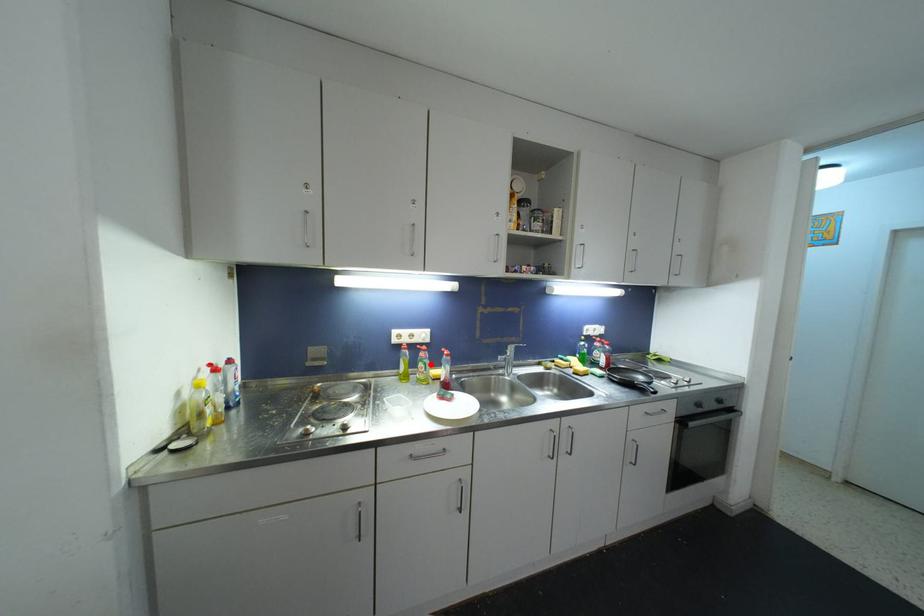
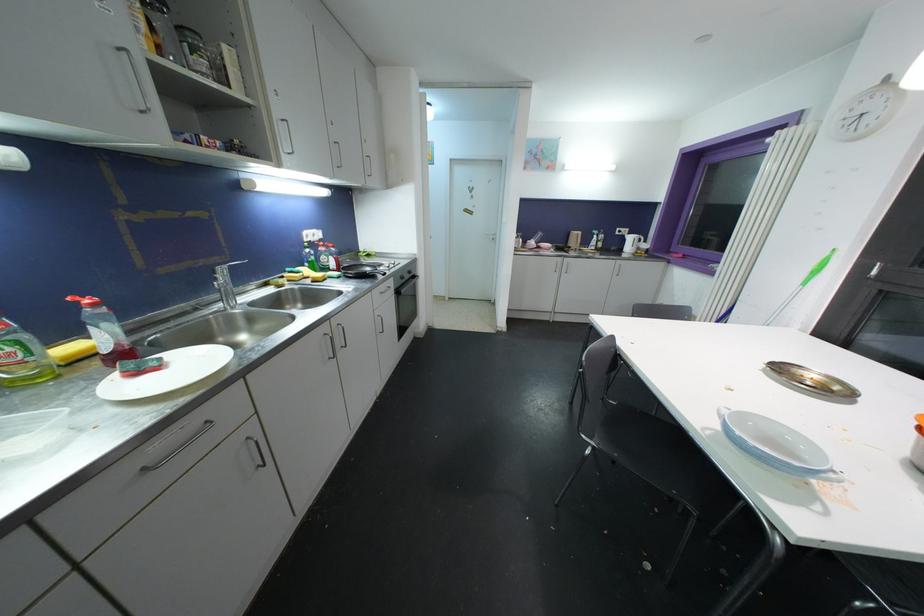
Find the pixel in the second image that matches the highlighted location in the first image.

(27, 339)